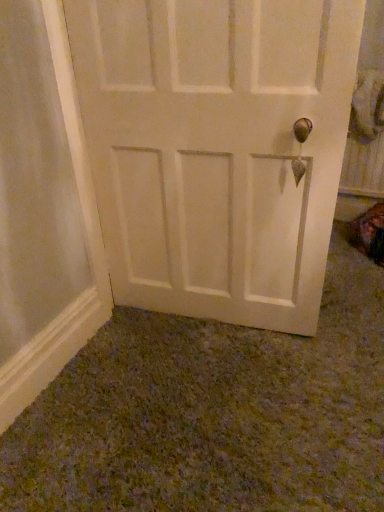
The height and width of the screenshot is (512, 384). What are the coordinates of `white matte door at center` in the screenshot? It's located at (216, 149).

This screenshot has height=512, width=384. Describe the element at coordinates (216, 149) in the screenshot. I see `white matte door at center` at that location.

In order to face white matte door at center, should I rotate leftwards or rightwards?

A 1.878 degree turn to the right will do.

What is the approximate height of white matte door at center?

The height of white matte door at center is 1.09 meters.

The width and height of the screenshot is (384, 512). In order to click on white matte door at center in this screenshot , I will do `click(216, 149)`.